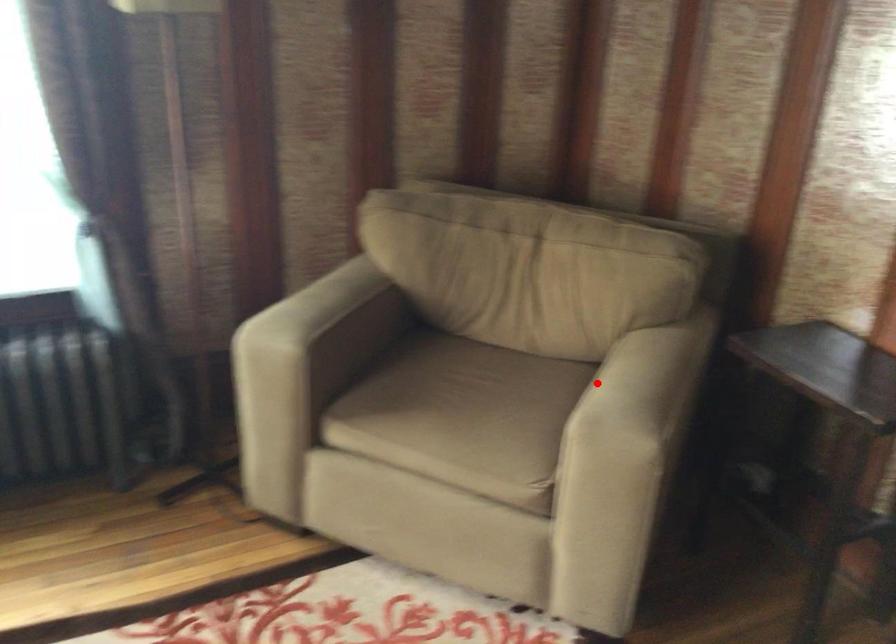
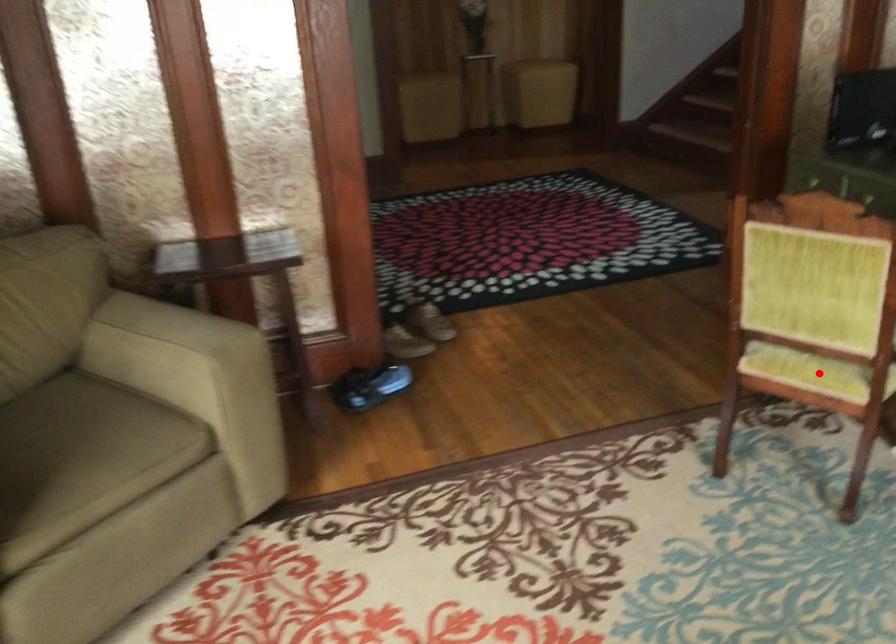
I am providing you with two images of the same scene from different viewpoints. A red point is marked on the first image and another point is marked on the second image. Are the points marked in image1 and image2 representing the same 3D position?

No